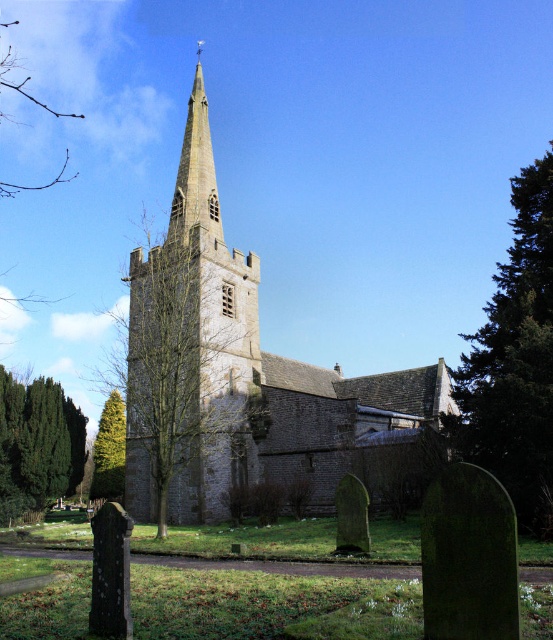
You are standing in the graveyard and see the green evergreen tree at lower left and the green textured tree at lower left. Which tree is closer to the ground?

The green evergreen tree at lower left is closer to the ground because it is positioned below the green textured tree at lower left.

You are standing in the graveyard of the church and want to find a taller tree to rest under. Which tree should you choose between the green leafy tree at right and the green evergreen tree at lower left?

The green leafy tree at right is taller than the green evergreen tree at lower left, so you should choose the green leafy tree at right to rest under.

In the scene shown: You are standing at the point marked as point (38, 444) in the image. Looking towards the church, what do you see in the direction of the point?

The point (38, 444) corresponds to a green evergreen tree at lower left, so looking towards the church from that point, you would see the green evergreen tree at lower left in the direction of the point.